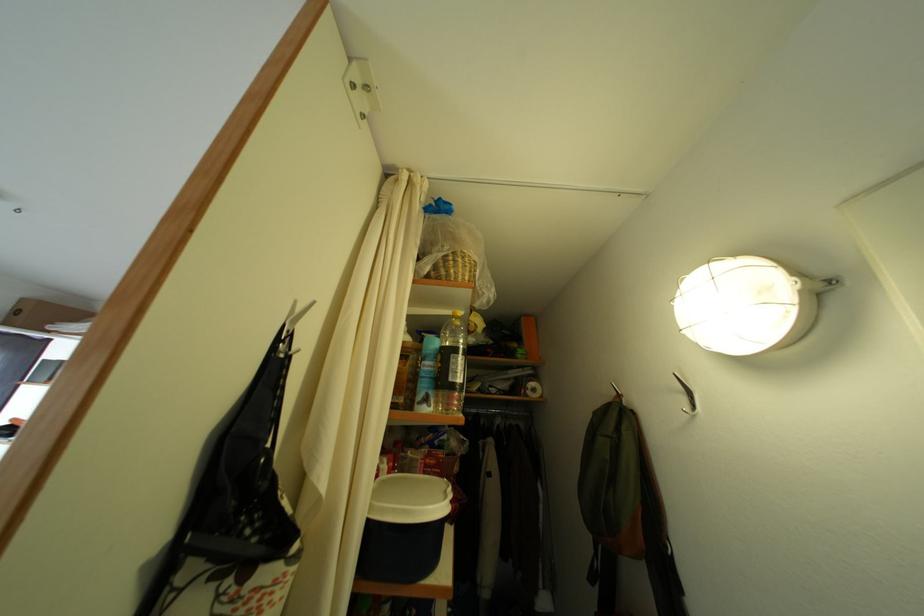
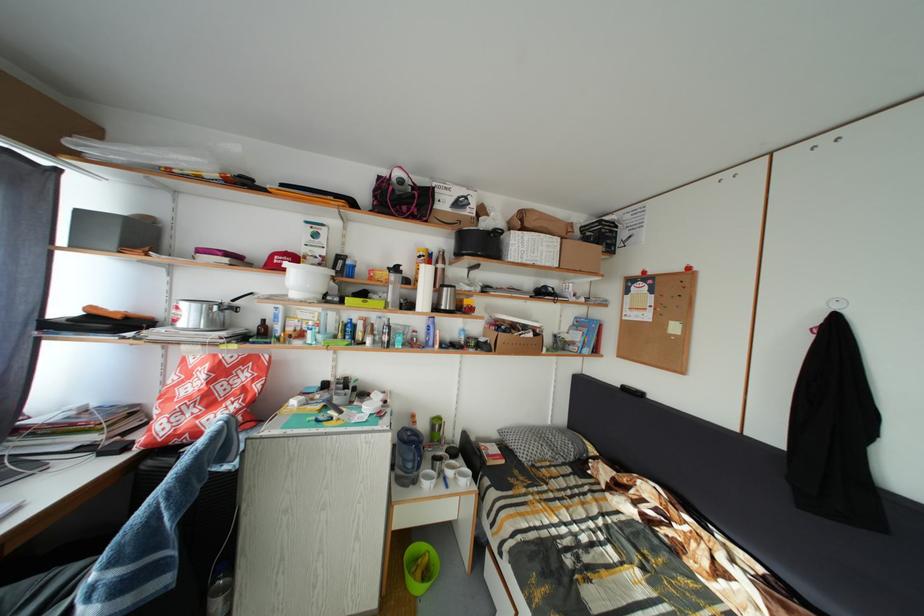
Question: Which direction would the cameraman need to move to produce the second image? Reply with the corresponding letter.

Choices:
 (A) Left
 (B) Right
 (C) Forward
 (D) Backward

Answer: (A)